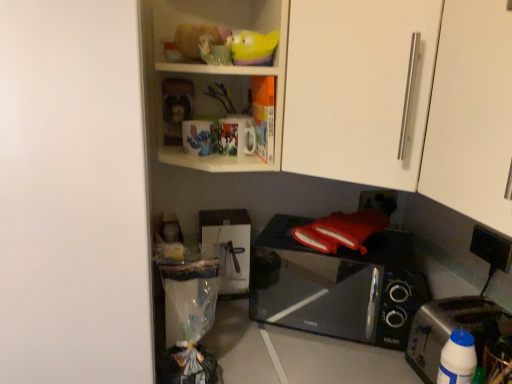
Question: In terms of width, does black plastic electric outlet at lower right look wider or thinner when compared to matte plastic shelf at upper center?

Choices:
 (A) wide
 (B) thin

Answer: (B)

Question: Is black plastic electric outlet at lower right spatially inside matte plastic shelf at upper center, or outside of it?

Choices:
 (A) outside
 (B) inside

Answer: (A)

Question: Considering the real-world distances, which object is farthest from the black plastic electric outlet at lower right?

Choices:
 (A) matte plastic shelf at upper center
 (B) silver metallic toaster at lower right
 (C) white matte cabinet at right, acting as the first cabinetry starting from the front
 (D) white matte door at left
 (E) white matte cabinet door at upper right, the second cabinetry when ordered from front to back

Answer: (D)

Question: Which of these objects is positioned closest to the white matte cabinet at right, positioned as the 2th cabinetry in back-to-front order?

Choices:
 (A) yellow rubber duck at upper center
 (B) white plastic bottle at lower right
 (C) black glossy microwave oven at lower right
 (D) white matte door at left
 (E) matte plastic shelf at upper center

Answer: (A)